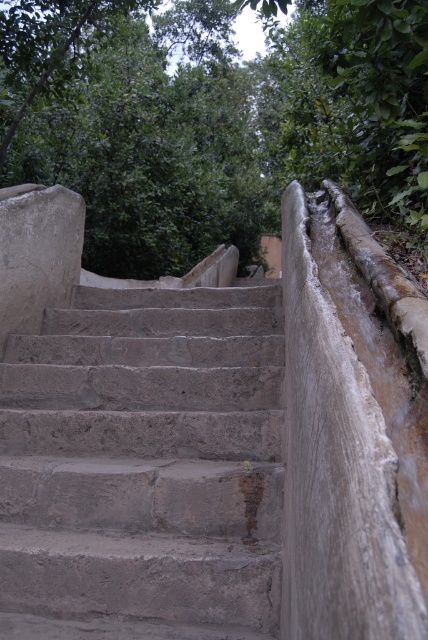
From the picture: You are a hiker carrying a backpack weighing 15 kilograms. You need to climb the gray stone stairs at center to reach the green leafy tree at upper center. The path is narrow. Can you safely carry your backpack while climbing the stairs?

The gray stone stairs at center and green leafy tree at upper center are 4.27 meters apart. Since the distance is short, you can safely carry your 15 kg backpack while climbing the stairs.

You are standing at the bottom of the gray stone stairs at center and want to reach the green leafy tree at upper center. Which direction should you move towards to get closer to the tree?

You should move to the left because the gray stone stairs at center are to the right of the green leafy tree at upper center, so moving left will bring you closer to the tree.